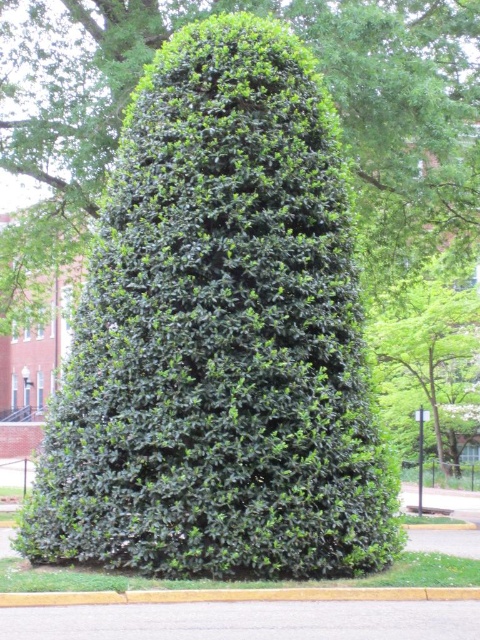
Between green leafy hedge at center and yellow asphalt curb at lower center, which one has more height?

green leafy hedge at center

Is green leafy hedge at center smaller than yellow asphalt curb at lower center?

No, green leafy hedge at center is not smaller than yellow asphalt curb at lower center.

Which is in front, point (121, 467) or point (409, 596)?

Point (409, 596) is more forward.

Where is `green leafy hedge at center`? This screenshot has width=480, height=640. green leafy hedge at center is located at coordinates (219, 337).